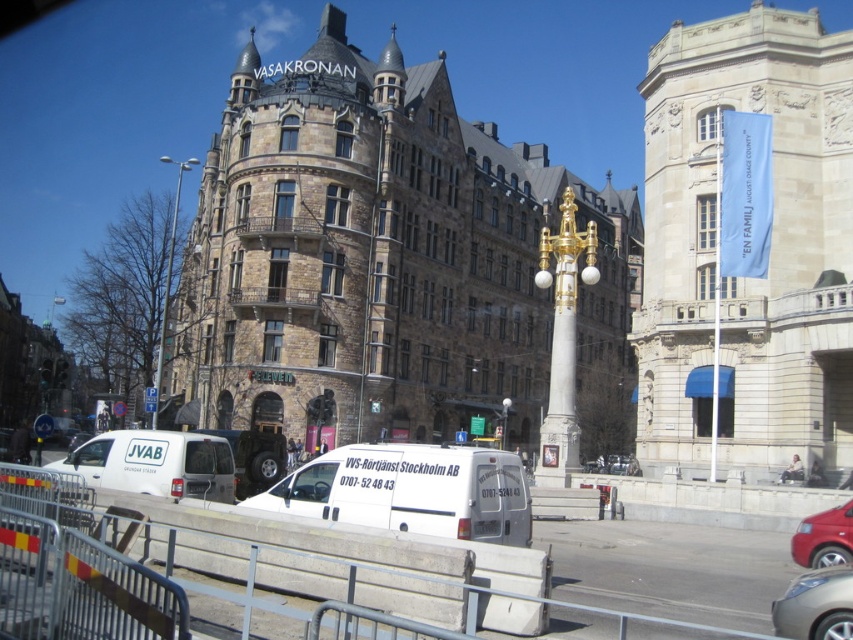
Question: Which of the following is the closest to the observer?

Choices:
 (A) (612, 461)
 (B) (136, 436)
 (C) (473, 500)

Answer: (C)

Question: Does white matte van at lower left have a smaller size compared to shiny red car at lower right?

Choices:
 (A) yes
 (B) no

Answer: (B)

Question: Observing the image, what is the correct spatial positioning of white matte van at lower left in reference to silver metallic car at lower right?

Choices:
 (A) below
 (B) above

Answer: (B)

Question: Which point is closer to the camera taking this photo?

Choices:
 (A) 367,460
 (B) 213,476
 (C) 849,628
 (D) 633,467

Answer: (C)

Question: Which object appears closest to the camera in this image?

Choices:
 (A) metallic silver car at center
 (B) white matte van at center
 (C) shiny red car at lower right
 (D) silver metallic car at lower right

Answer: (D)

Question: Where is white matte van at center located in relation to white matte van at lower left in the image?

Choices:
 (A) left
 (B) right

Answer: (B)